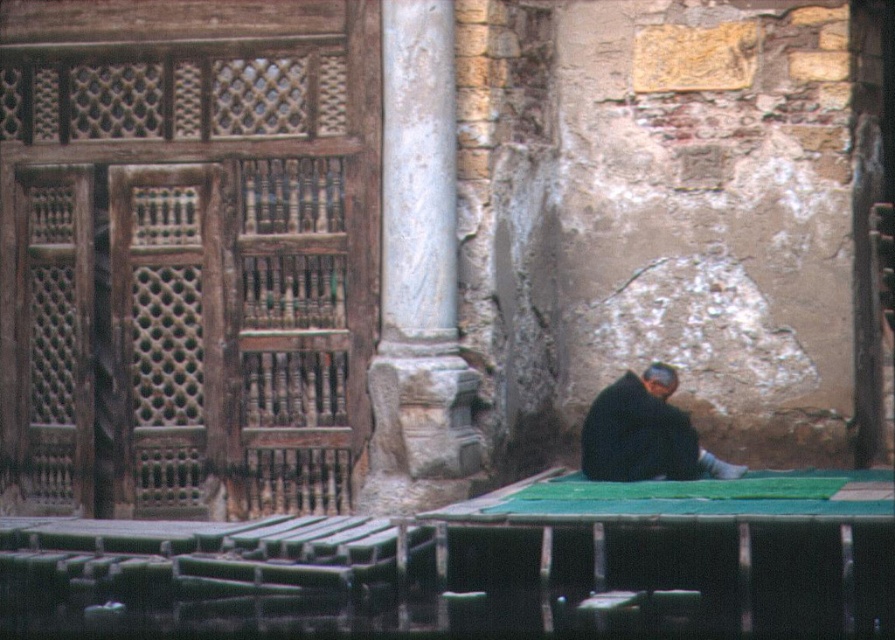
The height and width of the screenshot is (640, 895). I want to click on white marble column at center, so click(x=419, y=260).

Which is behind, point (429, 13) or point (650, 365)?

Point (650, 365)

I want to click on white marble column at center, so click(x=419, y=260).